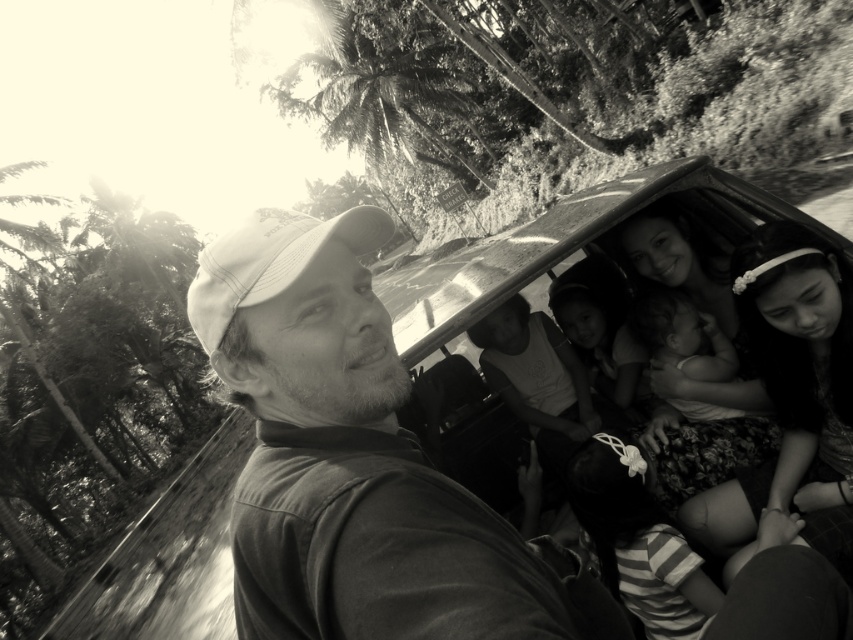
Can you confirm if metallic car at center is thinner than smooth skin child at center?

No.

Does metallic car at center have a smaller size compared to smooth skin child at center?

Incorrect, metallic car at center is not smaller in size than smooth skin child at center.

Who is more forward, (589, 230) or (573, 328)?

Point (589, 230) is in front.

This screenshot has width=853, height=640. I want to click on metallic car at center, so click(550, 291).

Is striped fabric shirt at lower center positioned behind white fabric baseball cap at center?

Yes, striped fabric shirt at lower center is further from the viewer.

Is striped fabric shirt at lower center to the right of white fabric baseball cap at center from the viewer's perspective?

Yes, striped fabric shirt at lower center is to the right of white fabric baseball cap at center.

Measure the distance between point [604,547] and camera.

Point [604,547] and camera are 7.03 feet apart from each other.

Identify the location of striped fabric shirt at lower center. (633, 541).

Who is shorter, white fabric cap at center or smooth skin child at center?

smooth skin child at center

Who is higher up, white fabric cap at center or smooth skin child at center?

smooth skin child at center

Is point (341, 444) farther from camera compared to point (573, 346)?

No, it is in front of (573, 346).

This screenshot has height=640, width=853. I want to click on white fabric cap at center, so (346, 456).